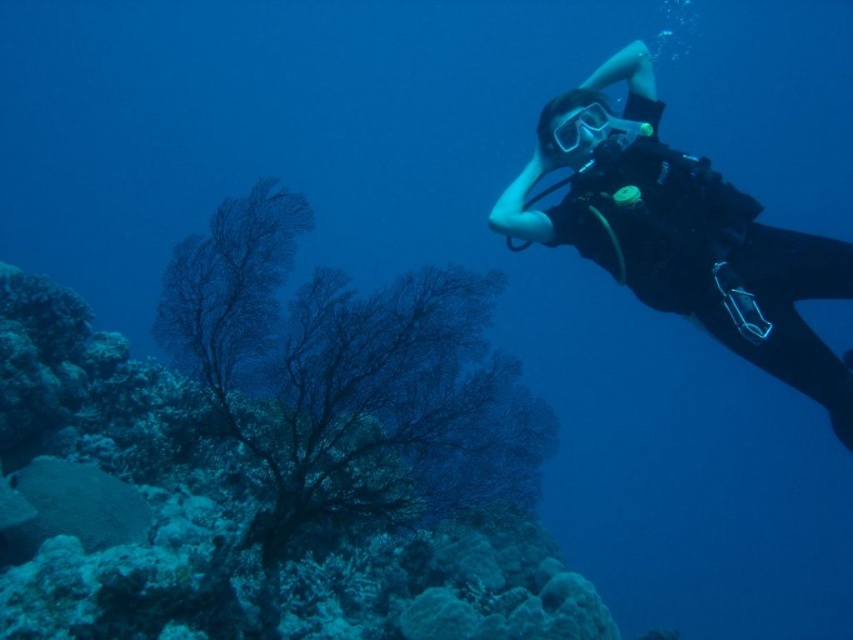
Question: Does black matte scuba diver at right have a larger size compared to transparent rubber goggles at upper right?

Choices:
 (A) no
 (B) yes

Answer: (B)

Question: Which point is farther from the camera taking this photo?

Choices:
 (A) (590, 122)
 (B) (105, 552)
 (C) (627, 61)

Answer: (C)

Question: Does dark green coral at lower left appear under black matte scuba diver at right?

Choices:
 (A) no
 (B) yes

Answer: (B)

Question: Which of the following is the closest to the observer?

Choices:
 (A) (593, 129)
 (B) (73, 624)

Answer: (B)

Question: Can you confirm if black matte scuba diver at right is thinner than transparent rubber goggles at upper right?

Choices:
 (A) yes
 (B) no

Answer: (B)

Question: Which point appears closest to the camera in this image?

Choices:
 (A) (514, 609)
 (B) (653, 161)

Answer: (A)